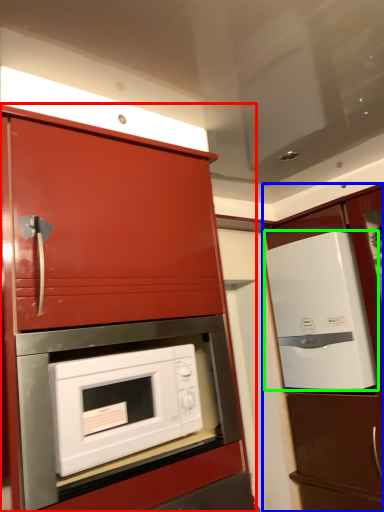
Question: Based on their relative distances, which object is nearer to cabinetry (highlighted by a red box)? Choose from cabinetry (highlighted by a blue box) and refrigerator (highlighted by a green box).

Choices:
 (A) cabinetry
 (B) refrigerator

Answer: (B)